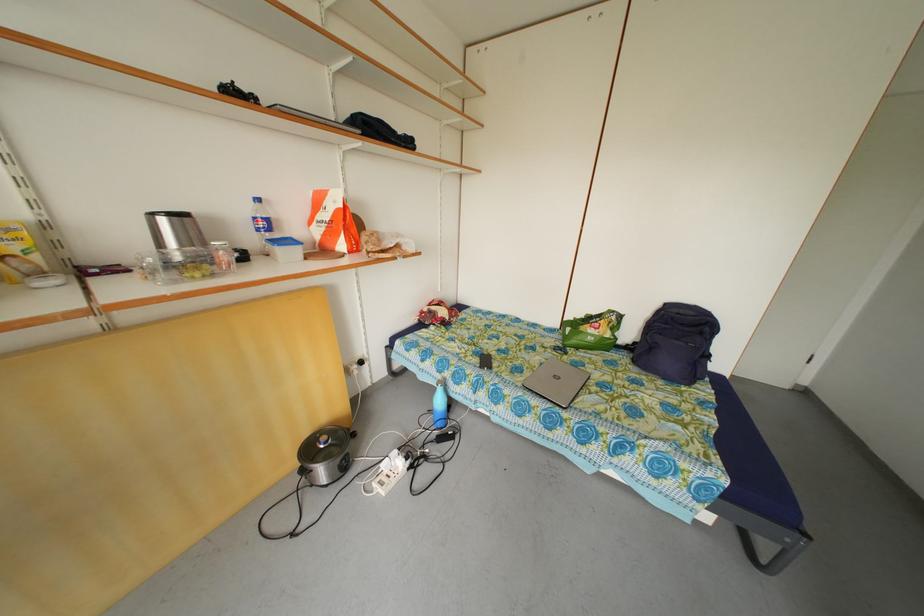
Identify the location of blue bottle cap. Image resolution: width=924 pixels, height=616 pixels. (254, 199).